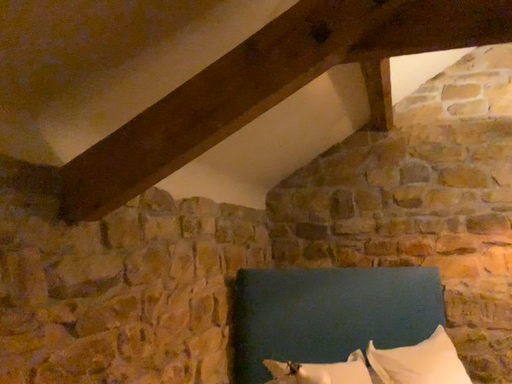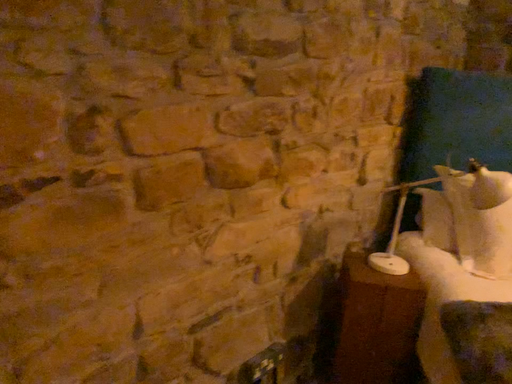
Question: How did the camera likely rotate when shooting the video?

Choices:
 (A) rotated right
 (B) rotated left

Answer: (B)